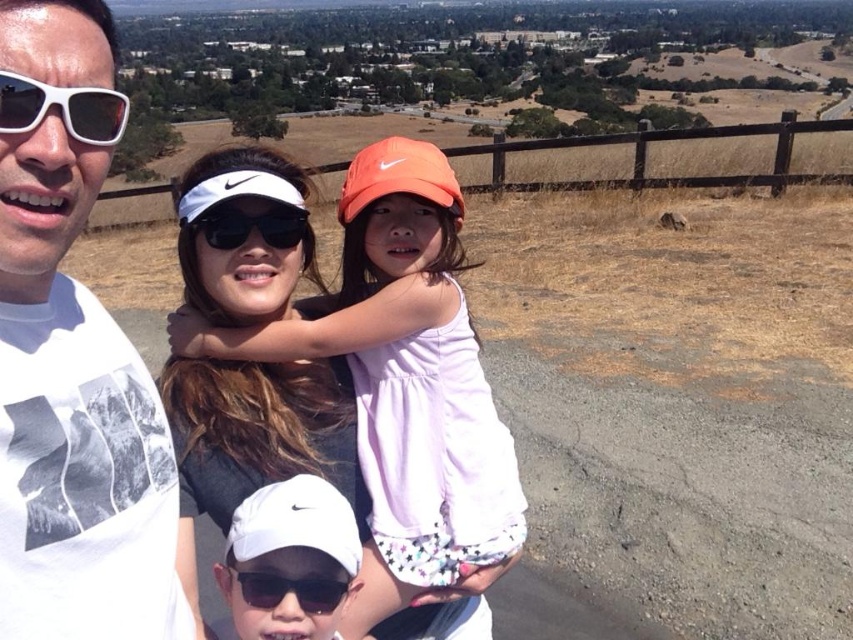
Question: Does white cotton dress at center appear on the right side of white matte sunglasses at upper left?

Choices:
 (A) yes
 (B) no

Answer: (A)

Question: Can you confirm if white printed t-shirt at left is thinner than black plastic sunglasses at lower center?

Choices:
 (A) no
 (B) yes

Answer: (A)

Question: Which point is closer to the camera?

Choices:
 (A) (289, 216)
 (B) (114, 381)

Answer: (B)

Question: Does white printed t-shirt at left have a greater width compared to white cotton dress at center?

Choices:
 (A) no
 (B) yes

Answer: (A)

Question: Based on their relative distances, which object is farther from the white printed t-shirt at left?

Choices:
 (A) black plastic sunglasses at lower center
 (B) black matte sunglasses at center

Answer: (B)

Question: Which object appears farthest from the camera in this image?

Choices:
 (A) black matte sunglasses at center
 (B) white printed t-shirt at left

Answer: (A)